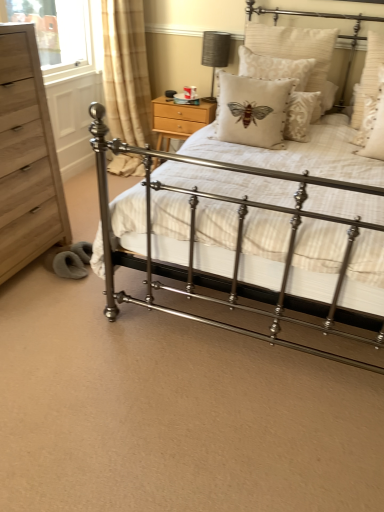
Question: Can you confirm if white textured pillow with moth design at center, marked as the fifth pillow in a right-to-left arrangement, is bigger than wooden nightstand at upper center?

Choices:
 (A) no
 (B) yes

Answer: (A)

Question: Is white textured pillow with moth design at center, which appears as the first pillow when viewed from the left, turned away from wooden nightstand at upper center?

Choices:
 (A) yes
 (B) no

Answer: (B)

Question: From a real-world perspective, is white textured pillow with moth design at center, marked as the fifth pillow in a right-to-left arrangement, physically above wooden nightstand at upper center?

Choices:
 (A) no
 (B) yes

Answer: (B)

Question: Is white textured pillow with moth design at center, marked as the fifth pillow in a right-to-left arrangement, thinner than wooden nightstand at upper center?

Choices:
 (A) no
 (B) yes

Answer: (B)

Question: Is white textured pillow with moth design at center, which appears as the first pillow when viewed from the left, at the right side of wooden nightstand at upper center?

Choices:
 (A) no
 (B) yes

Answer: (B)

Question: Is light brown wood chest of drawers at left inside or outside of beige textured pillow with bee design at center, which appears as the 3th pillow when viewed from the left?

Choices:
 (A) inside
 (B) outside

Answer: (B)

Question: Considering the positions of light brown wood chest of drawers at left and beige textured pillow with bee design at center, arranged as the third pillow when viewed from the right, in the image, is light brown wood chest of drawers at left taller or shorter than beige textured pillow with bee design at center, arranged as the third pillow when viewed from the right,?

Choices:
 (A) tall
 (B) short

Answer: (A)

Question: Considering the positions of light brown wood chest of drawers at left and beige textured pillow with bee design at center, arranged as the third pillow when viewed from the right, in the image, is light brown wood chest of drawers at left bigger or smaller than beige textured pillow with bee design at center, arranged as the third pillow when viewed from the right,?

Choices:
 (A) small
 (B) big

Answer: (B)

Question: Is point (9, 32) closer or farther from the camera than point (291, 56)?

Choices:
 (A) farther
 (B) closer

Answer: (B)

Question: Is metallic iron bed at center spatially inside white textured pillow with moth design at center, which appears as the first pillow when viewed from the left, or outside of it?

Choices:
 (A) outside
 (B) inside

Answer: (A)

Question: Is point (332, 140) positioned closer to the camera than point (279, 80)?

Choices:
 (A) farther
 (B) closer

Answer: (A)

Question: From their relative heights in the image, would you say metallic iron bed at center is taller or shorter than white textured pillow with moth design at center, which appears as the first pillow when viewed from the left?

Choices:
 (A) short
 (B) tall

Answer: (B)

Question: Visually, is metallic iron bed at center positioned to the left or to the right of white textured pillow with moth design at center, marked as the fifth pillow in a right-to-left arrangement?

Choices:
 (A) right
 (B) left

Answer: (A)

Question: Considering the positions of white textured pillow with moth design at center, which appears as the first pillow when viewed from the left, and white textured pillow at upper right, which ranks as the 1th pillow in right-to-left order, in the image, is white textured pillow with moth design at center, which appears as the first pillow when viewed from the left, bigger or smaller than white textured pillow at upper right, which ranks as the 1th pillow in right-to-left order,?

Choices:
 (A) big
 (B) small

Answer: (A)

Question: Is white textured pillow with moth design at center, marked as the fifth pillow in a right-to-left arrangement, taller or shorter than white textured pillow at upper right, which ranks as the 1th pillow in right-to-left order?

Choices:
 (A) short
 (B) tall

Answer: (A)